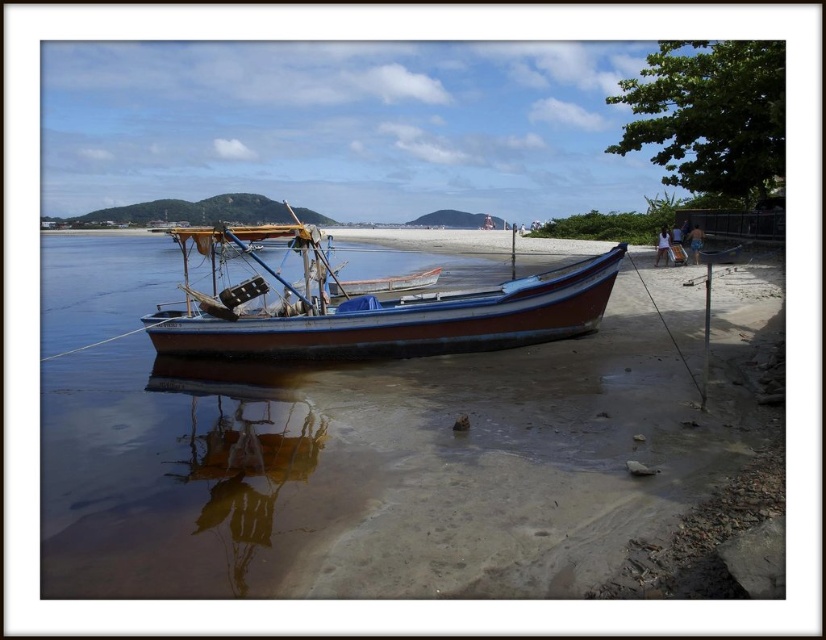
Question: Is brown reflective water at center further to the viewer compared to wooden boat at center?

Choices:
 (A) yes
 (B) no

Answer: (B)

Question: Which point is farther from the camera taking this photo?

Choices:
 (A) (589, 291)
 (B) (307, 369)

Answer: (A)

Question: Is brown reflective water at center to the right of wooden boat at center from the viewer's perspective?

Choices:
 (A) yes
 (B) no

Answer: (A)

Question: Is brown reflective water at center positioned behind wooden boat at center?

Choices:
 (A) yes
 (B) no

Answer: (B)